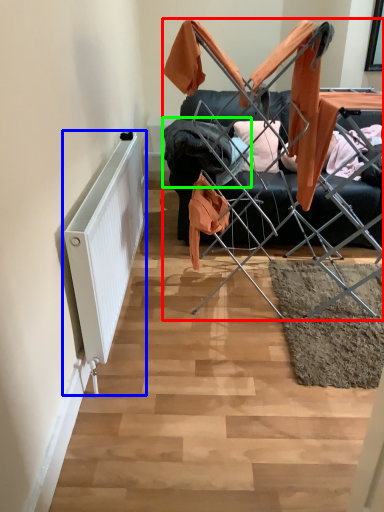
Question: Based on their relative distances, which object is nearer to furniture (highlighted by a red box)? Choose from radiator (highlighted by a blue box) and clothing (highlighted by a green box).

Choices:
 (A) radiator
 (B) clothing

Answer: (B)